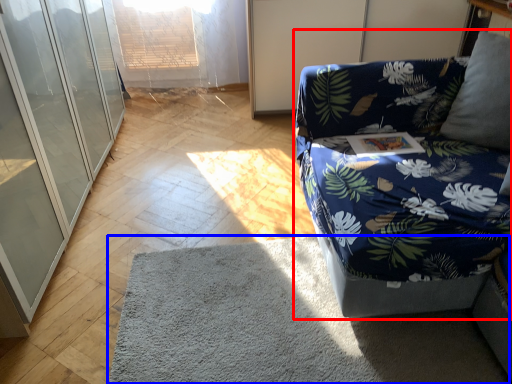
Question: Which of the following is the farthest to the observer, studio couch (highlighted by a red box) or mat (highlighted by a blue box)?

Choices:
 (A) studio couch
 (B) mat

Answer: (B)